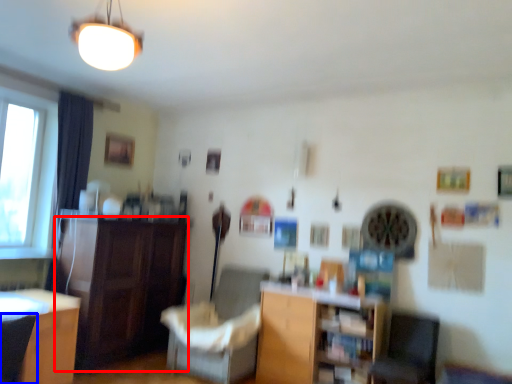
Question: Which of the following is the closest to the observer, cabinetry (highlighted by a red box) or armchair (highlighted by a blue box)?

Choices:
 (A) cabinetry
 (B) armchair

Answer: (B)